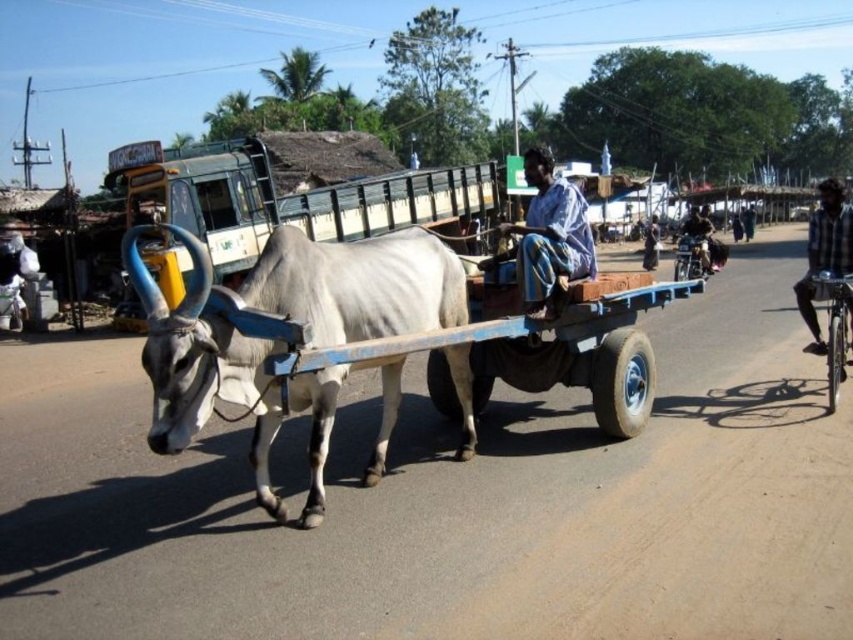
Question: Based on their relative distances, which object is farther from the dark blue fabric at center?

Choices:
 (A) white matte bull at center
 (B) dark blue plaid shirt at right
 (C) blue fabric shirt at center

Answer: (A)

Question: Which point is farther from the camera taking this photo?

Choices:
 (A) (496, 260)
 (B) (282, 516)
 (C) (828, 189)
 (D) (648, 264)

Answer: (D)

Question: Which object appears farthest from the camera in this image?

Choices:
 (A) blue fabric shirt at center
 (B) dark blue fabric at center
 (C) white matte bull at center
 (D) dark blue plaid shirt at right

Answer: (B)

Question: Observing the image, what is the correct spatial positioning of blue fabric shirt at center in reference to dark blue fabric at center?

Choices:
 (A) left
 (B) right

Answer: (A)

Question: Is white matte bull at center positioned at the back of blue fabric shirt at center?

Choices:
 (A) no
 (B) yes

Answer: (A)

Question: Does blue fabric shirt at center have a smaller size compared to dark blue plaid shirt at right?

Choices:
 (A) no
 (B) yes

Answer: (B)